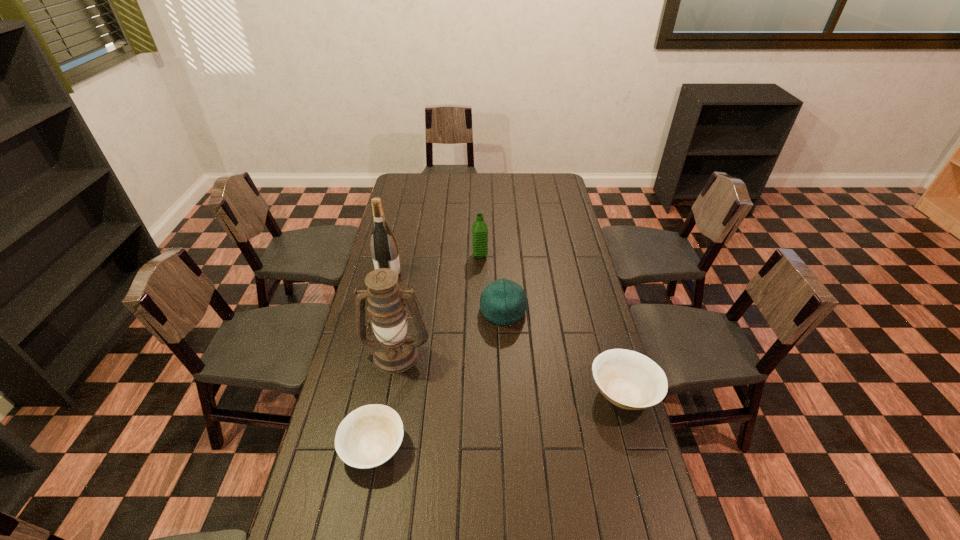
In order to click on vacant space at the far edge in this screenshot , I will do `click(498, 188)`.

In the image, there is a desktop. Where is `vacant area at the right edge`? The width and height of the screenshot is (960, 540). vacant area at the right edge is located at coordinates (x=572, y=216).

What are the coordinates of `vacant area at the near left corner` in the screenshot? It's located at (301, 527).

Image resolution: width=960 pixels, height=540 pixels. What are the coordinates of `blank space at the far right corner of the desktop` in the screenshot? It's located at (564, 192).

The image size is (960, 540). I want to click on free space between the rightmost object and the farthest object, so click(x=552, y=324).

Where is `unoccupied position between the third tallest object and the shorter bowl`? unoccupied position between the third tallest object and the shorter bowl is located at coordinates click(x=427, y=352).

Identify the location of blank region between the fourth tallest object and the shorter bowl. (439, 380).

You are a GUI agent. You are given a task and a screenshot of the screen. Output one action in this format:
    pyautogui.click(x=<x>, y=<y>)
    Task: Click on the vacant area that lies between the farthest object and the oil lamp
    Image resolution: width=960 pixels, height=540 pixels.
    Given the screenshot: What is the action you would take?
    [438, 304]

Where is `vacant space in between the beanie and the second farthest object`? vacant space in between the beanie and the second farthest object is located at coordinates (446, 293).

Find the location of a particular element. The image size is (960, 540). vacant space that's between the fourth nearest object and the wine bottle is located at coordinates pyautogui.click(x=446, y=293).